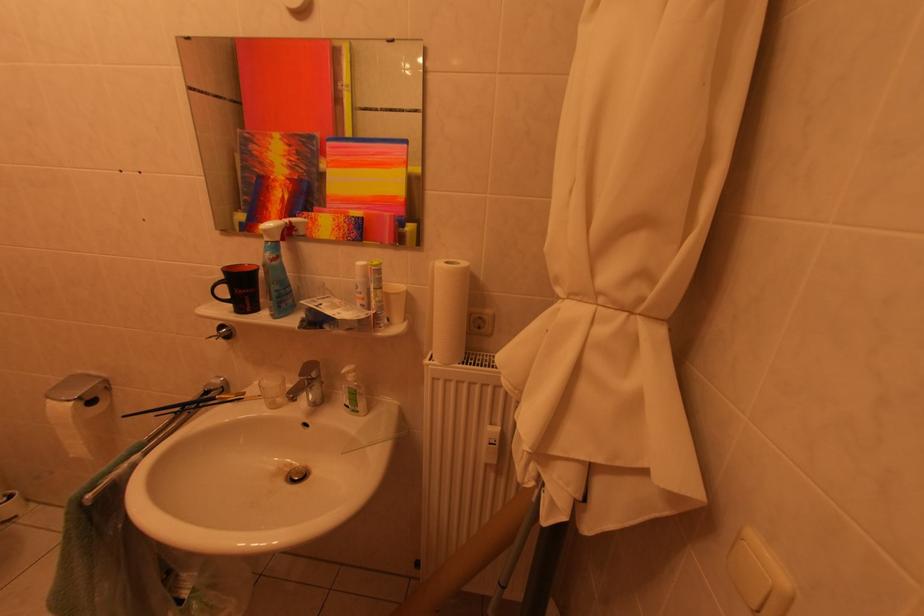
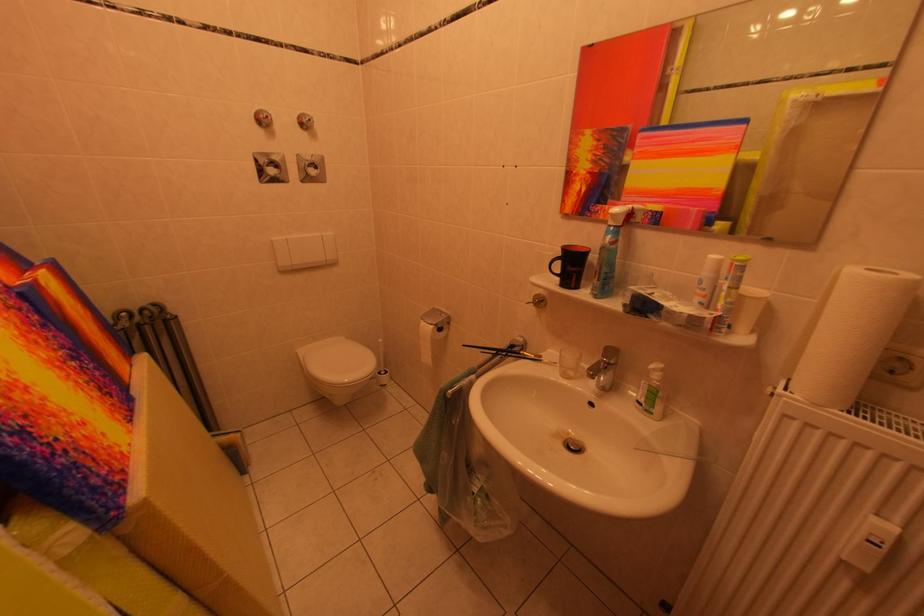
Question: The first image is from the beginning of the video and the second image is from the end. How did the camera likely rotate when shooting the video?

Choices:
 (A) Left
 (B) Right
 (C) Up
 (D) Down

Answer: (A)